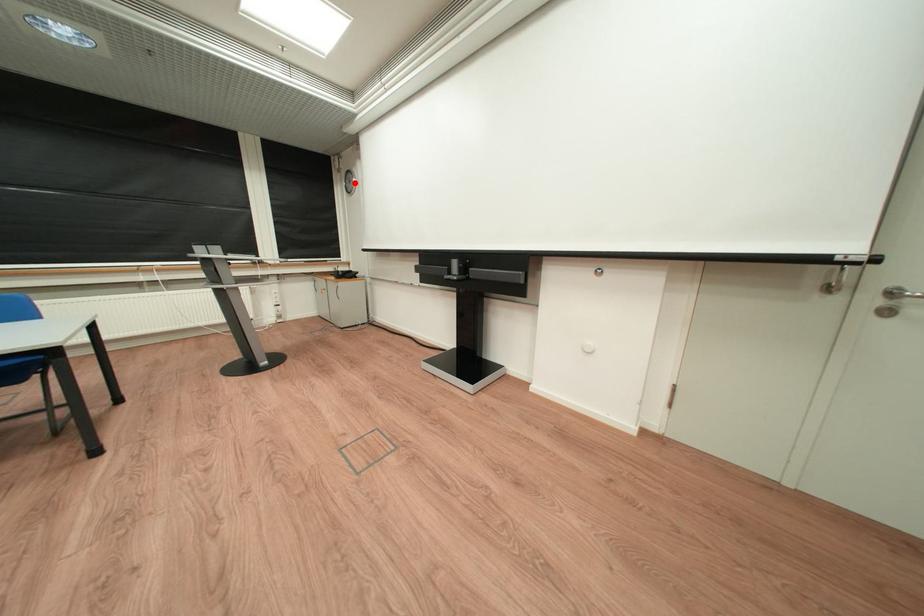
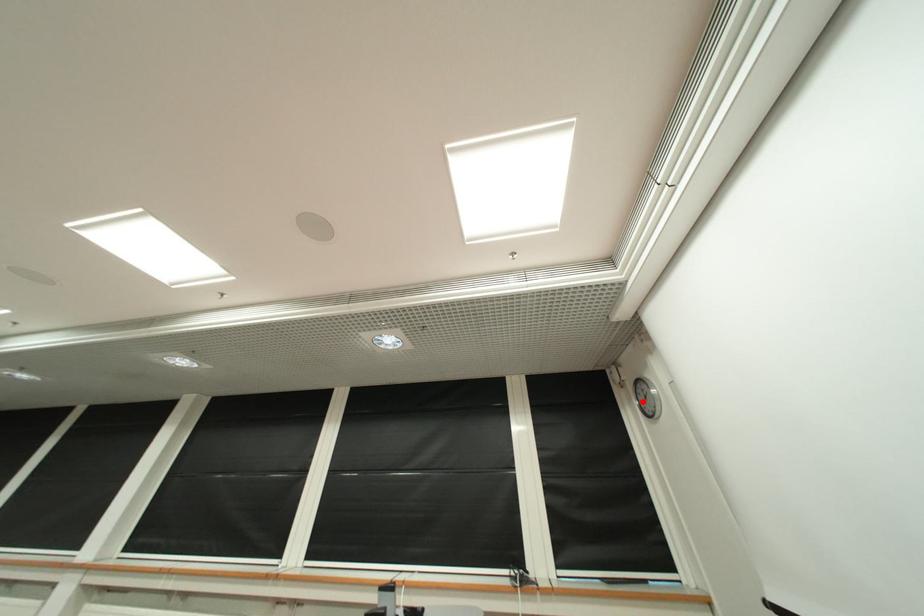
I am providing you with two images of the same scene from different viewpoints. A red point is marked on the first image and another point is marked on the second image. Is the red point in image1 aligned with the point shown in image2?

Yes